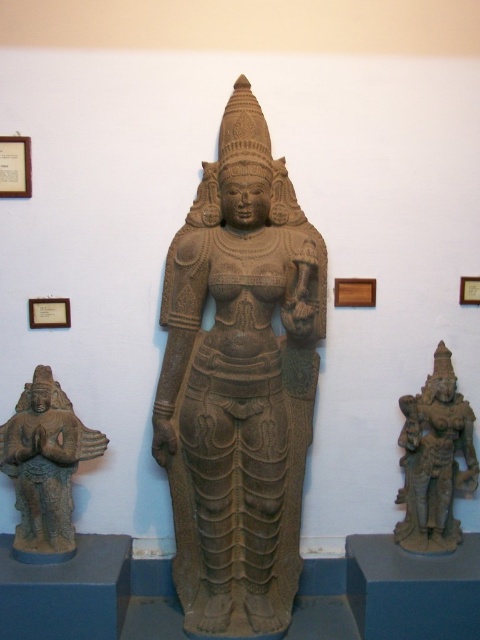
You are a museum curator planning to install a protective barrier between the brown stone statue at lower left and the brown stone statue at lower right. The barrier requires a minimum of 1.2 meters of space to be installed safely. Based on the scene, will the available space between them be sufficient for the barrier?

The distance between the brown stone statue at lower left and the brown stone statue at lower right is 1.16 meters, which is less than the required 1.2 meters. Therefore, the space is insufficient for the barrier.

You are a museum visitor standing in front of the brown stone statue at center. The museum has a strict rule that visitors must stay at least 8 feet away from all artifacts. Can you safely approach the statue to admire it without breaking the rule?

The brown stone statue at center is 7.30 feet away from the camera, which means you are already closer than the required 8 feet. Therefore, you should step back to maintain the 8 feet distance requirement.

Consider the image. You are standing in front of the stone sculptures in the museum. You want to take a photo of the central sculpture. If your camera can focus on objects up to 2.5 meters away, will it be able to focus on the point at coordinates point [101,440]?

The distance of point [101,440] from the camera is 2.39 meters, which is within the camera focus range of up to 2.5 meters. Therefore, the camera can focus on the point [101,440].